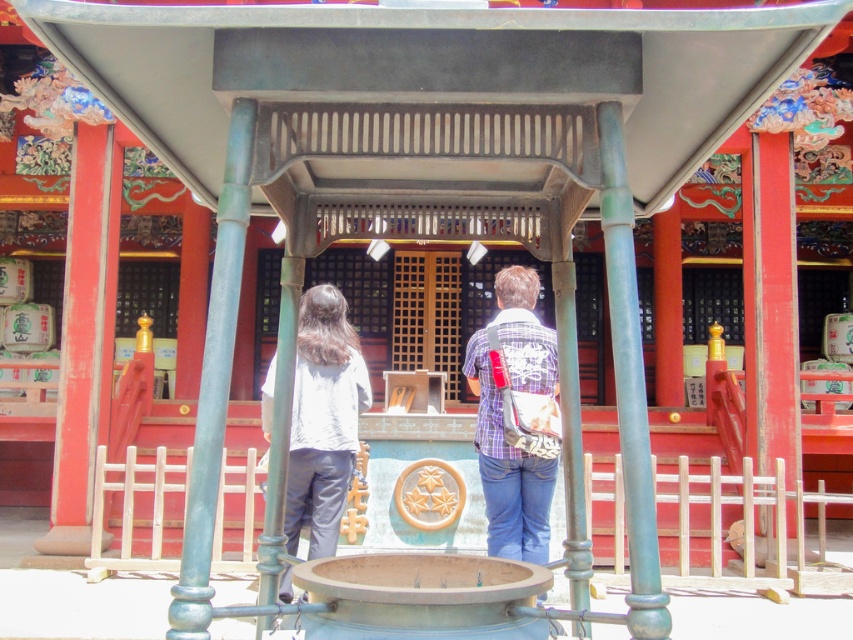
Question: Is light gray fabric shirt at center to the right of plaid fabric shirt at center from the viewer's perspective?

Choices:
 (A) yes
 (B) no

Answer: (B)

Question: Where is light gray fabric shirt at center located in relation to plaid fabric shirt at center in the image?

Choices:
 (A) above
 (B) below

Answer: (B)

Question: Considering the real-world distances, which object is farthest from the matte white shirt at center?

Choices:
 (A) plaid fabric shirt at center
 (B) light gray fabric shirt at center

Answer: (B)

Question: Among these points, which one is nearest to the camera?

Choices:
 (A) (508, 296)
 (B) (492, 506)
 (C) (312, 419)

Answer: (B)

Question: Among these points, which one is nearest to the camera?

Choices:
 (A) (537, 550)
 (B) (547, 557)
 (C) (323, 540)

Answer: (A)

Question: Does light gray fabric shirt at center appear on the left side of matte white shirt at center?

Choices:
 (A) yes
 (B) no

Answer: (A)